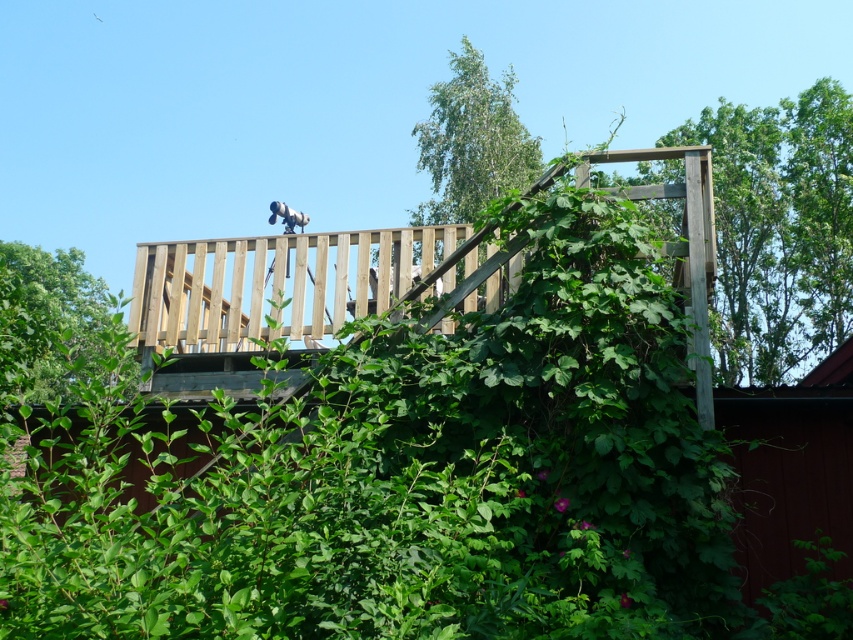
You are an environmental scientist analyzing the growth patterns of plants in urban settings. You observe the green leafy tree at upper right and the green leafy tree at upper center in the image. Which tree has a smaller diameter at breast height?

The green leafy tree at upper right has a smaller diameter at breast height since it is thinner than the green leafy tree at upper center according to the description.

You are standing on the ground floor looking up at the wooden at upper center and the green leafy tree at upper center. Which object is positioned higher in the vertical plane?

The wooden at upper center is located above the green leafy tree at upper center, so it is positioned higher in the vertical plane.

You are standing at the base of the building and looking up at the wooden structure with the telescope. There is a point marked at coordinates (778, 230). What object does this point indicate?

The point at coordinates (778, 230) indicates the green leafy tree at upper right.